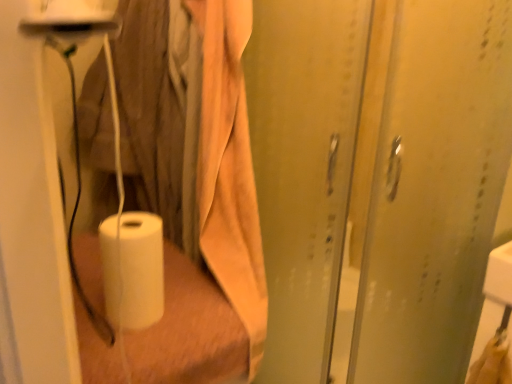
Question: Does white matte paper towel at lower left turn towards translucent plastic screen door at center, positioned as the first screen door in left-to-right order?

Choices:
 (A) no
 (B) yes

Answer: (A)

Question: Considering the relative sizes of white matte paper towel at lower left and translucent plastic screen door at center, positioned as the first screen door in left-to-right order, in the image provided, is white matte paper towel at lower left bigger than translucent plastic screen door at center, positioned as the first screen door in left-to-right order,?

Choices:
 (A) no
 (B) yes

Answer: (A)

Question: From the image's perspective, would you say white matte paper towel at lower left is positioned over translucent plastic screen door at center, arranged as the second screen door when viewed from the right?

Choices:
 (A) no
 (B) yes

Answer: (A)

Question: Is white matte paper towel at lower left positioned beyond the bounds of translucent plastic screen door at center, arranged as the second screen door when viewed from the right?

Choices:
 (A) yes
 (B) no

Answer: (A)

Question: Is white matte paper towel at lower left taller than translucent plastic screen door at center, arranged as the second screen door when viewed from the right?

Choices:
 (A) no
 (B) yes

Answer: (A)

Question: Can you confirm if white matte paper towel at lower left is smaller than translucent plastic screen door at center, positioned as the first screen door in left-to-right order?

Choices:
 (A) no
 (B) yes

Answer: (B)

Question: Would you say transparent plastic screen door at right, acting as the 1th screen door starting from the right, contains white matte paper towel at lower left?

Choices:
 (A) no
 (B) yes

Answer: (A)

Question: Is transparent plastic screen door at right, which is the second screen door from left to right, further to the viewer compared to white matte paper towel at lower left?

Choices:
 (A) yes
 (B) no

Answer: (B)

Question: Is transparent plastic screen door at right, which is the second screen door from left to right, closer to camera compared to white matte paper towel at lower left?

Choices:
 (A) no
 (B) yes

Answer: (B)

Question: Is transparent plastic screen door at right, acting as the 1th screen door starting from the right, shorter than white matte paper towel at lower left?

Choices:
 (A) yes
 (B) no

Answer: (B)

Question: From a real-world perspective, does transparent plastic screen door at right, which is the second screen door from left to right, sit lower than white matte paper towel at lower left?

Choices:
 (A) yes
 (B) no

Answer: (B)

Question: Does transparent plastic screen door at right, acting as the 1th screen door starting from the right, appear on the left side of white matte paper towel at lower left?

Choices:
 (A) no
 (B) yes

Answer: (A)

Question: Is translucent plastic screen door at center, arranged as the second screen door when viewed from the right, thinner than transparent plastic screen door at right, which is the second screen door from left to right?

Choices:
 (A) no
 (B) yes

Answer: (A)